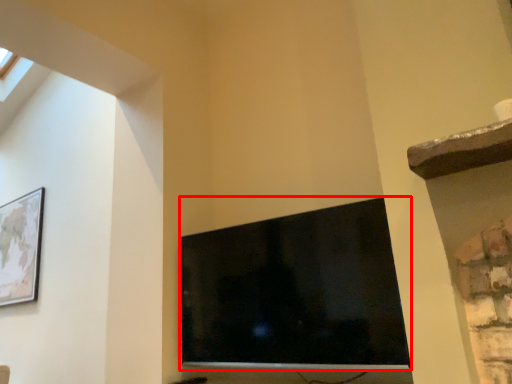
Question: From the image's perspective, where is television (annotated by the red box) located in relation to picture frame in the image?

Choices:
 (A) above
 (B) below

Answer: (B)